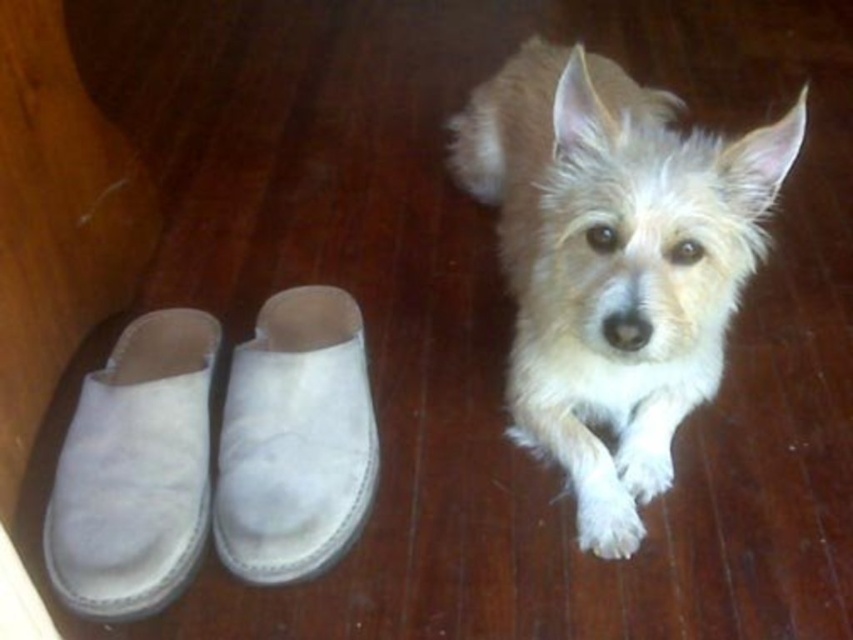
You are a delivery person who just arrived at the door. You see a white fluffy dog at center and a suede slipper at center. Which object is bigger in size?

The white fluffy dog at center is larger in size than the suede slipper at center.

From the picture: You are a small dog lying on the wooden floor. You want to move to the suede slipper at lower left located at point (135, 470). Which direction should you move to reach it?

The suede slipper at lower left is located at point (135, 470), so you should move towards the lower left direction to reach it.

You are a delivery person who just arrived at the door. You see a white fluffy dog at center and a suede slipper at center. Which object is closer to the left side of the door?

The suede slipper at center is closer to the left side of the door because the white fluffy dog at center is to the right of it.